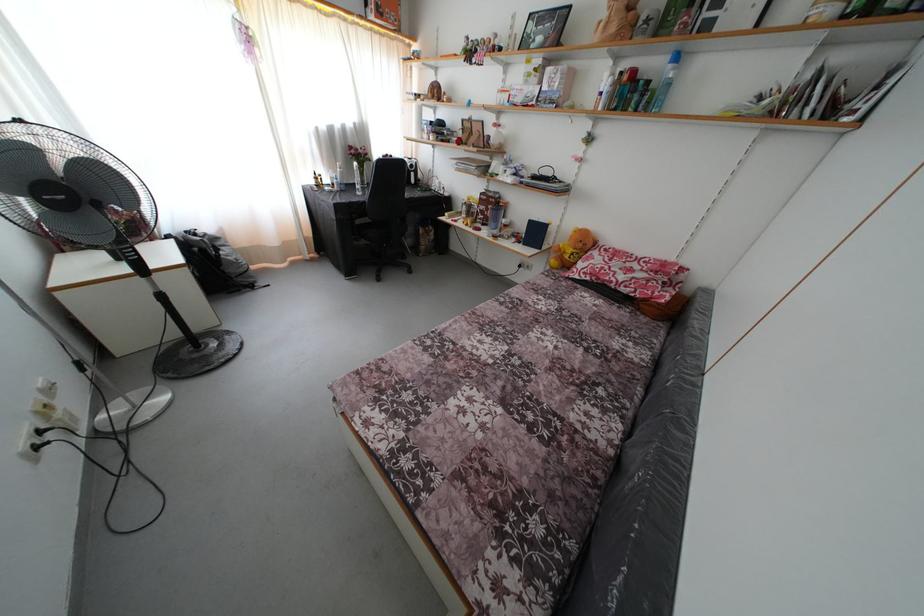
Image resolution: width=924 pixels, height=616 pixels. Find the location of `clear water bottle`. clear water bottle is located at coordinates (665, 81).